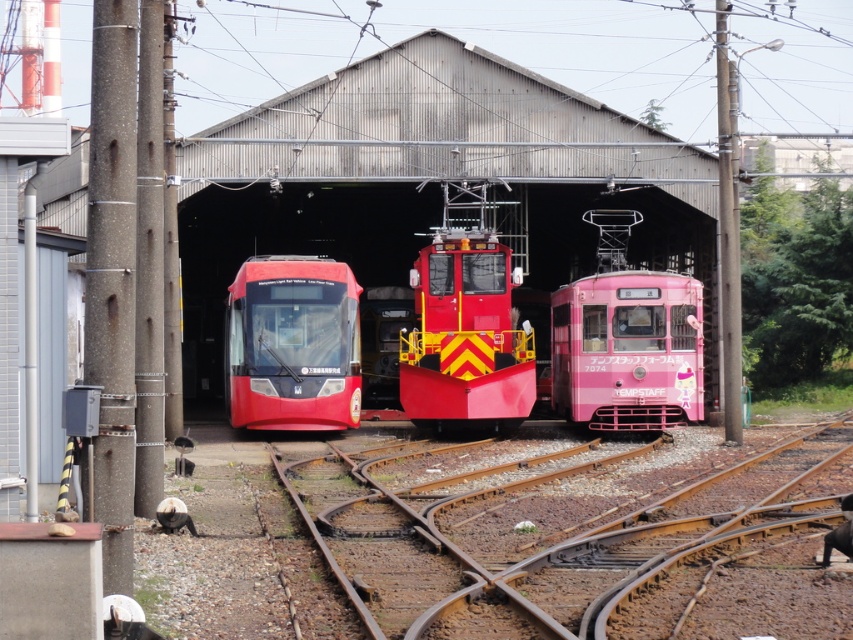
Question: Among these points, which one is farthest from the camera?

Choices:
 (A) (347, 589)
 (B) (346, 371)

Answer: (B)

Question: Is pink glossy tram at center wider than matte black train at center?

Choices:
 (A) yes
 (B) no

Answer: (A)

Question: Is brown metal train track at center above matte black train at center?

Choices:
 (A) yes
 (B) no

Answer: (B)

Question: Which is farther from the matte black train at center?

Choices:
 (A) pink glossy tram at center
 (B) brown metal train track at center

Answer: (B)

Question: Can you confirm if brown metal train track at center is positioned above matte black train at center?

Choices:
 (A) no
 (B) yes

Answer: (A)

Question: Which object is farther from the camera taking this photo?

Choices:
 (A) brown metal train track at center
 (B) matte black train at center
 (C) pink glossy tram at center

Answer: (B)